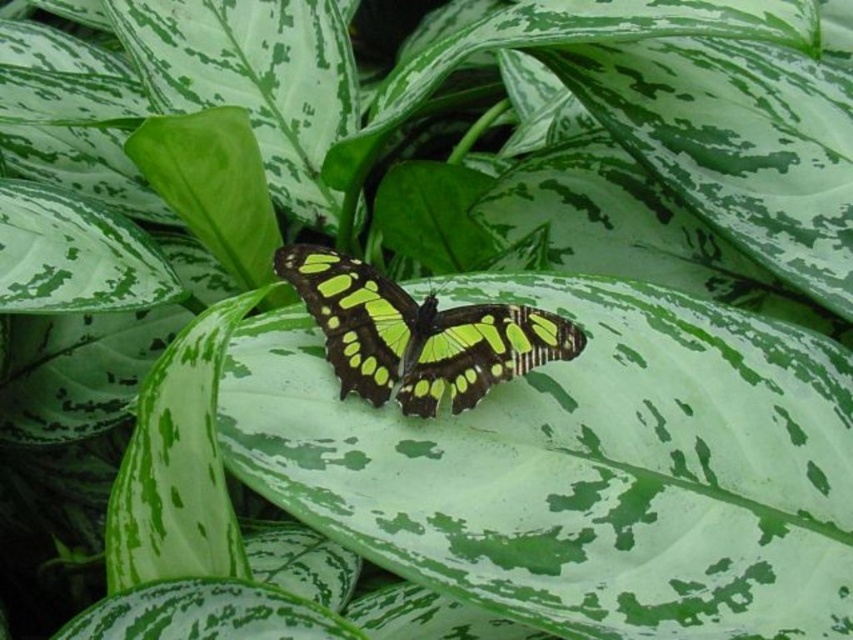
From the picture: You are observing the butterfly and the leaf in the scene. Which of the two points, point [543,586] or point [415,328], is closer to you?

Point [543,586] is closer to the viewer than point [415,328].